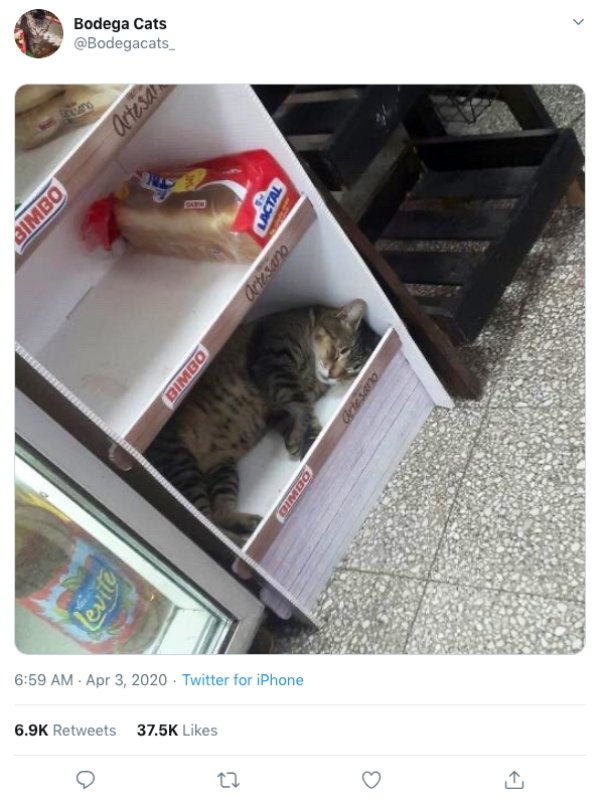
You are a GUI agent. You are given a task and a screenshot of the screen. Output one action in this format:
    pyautogui.click(x=<x>, y=<y>)
    Task: Click on the tiled flooring
    The width and height of the screenshot is (600, 803).
    Given the screenshot: What is the action you would take?
    pyautogui.click(x=506, y=512)